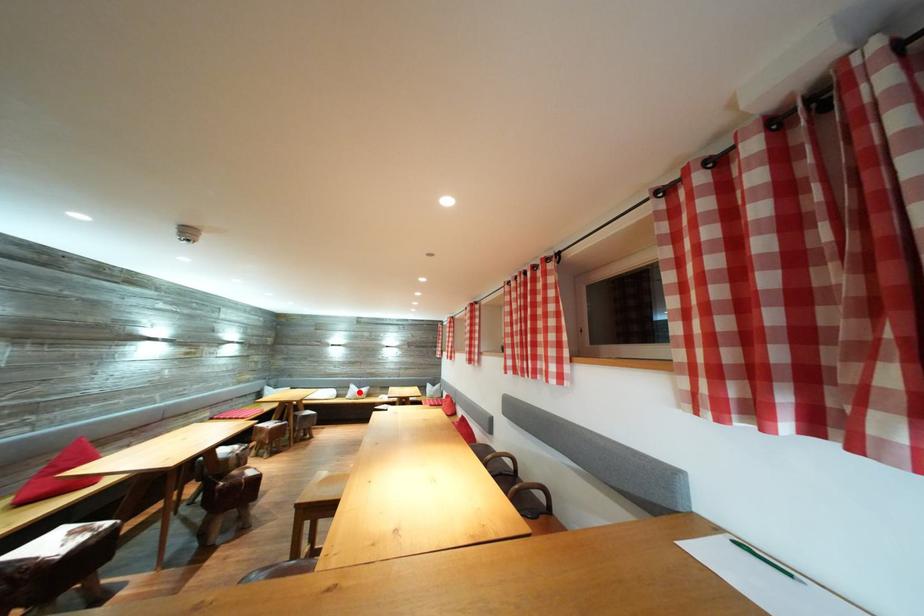
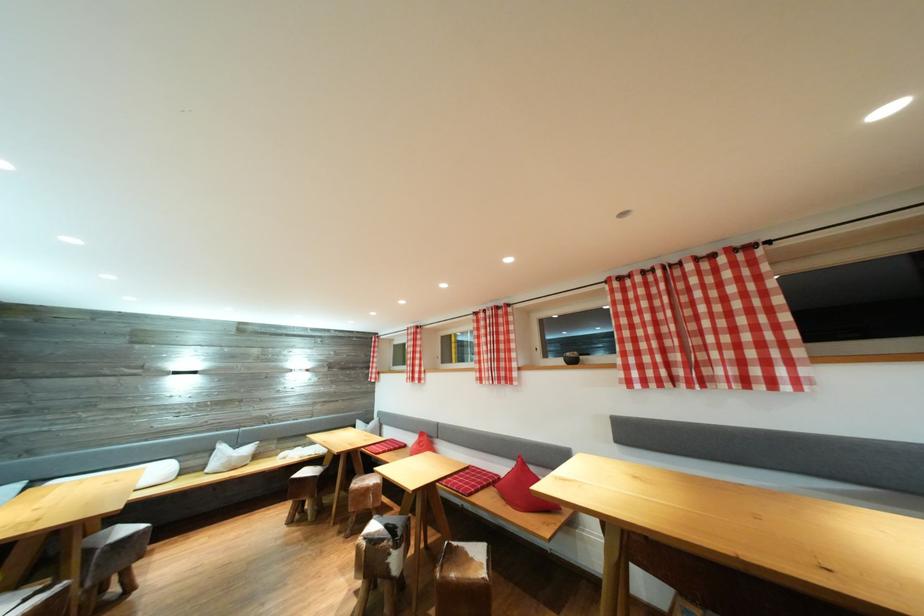
Question: I am providing you with two images of the same scene from different viewpoints. Given a red point in image1, look at the same physical point in image2. Is it:

Choices:
 (A) Closer to the viewpoint
 (B) Farther from the viewpoint

Answer: (A)